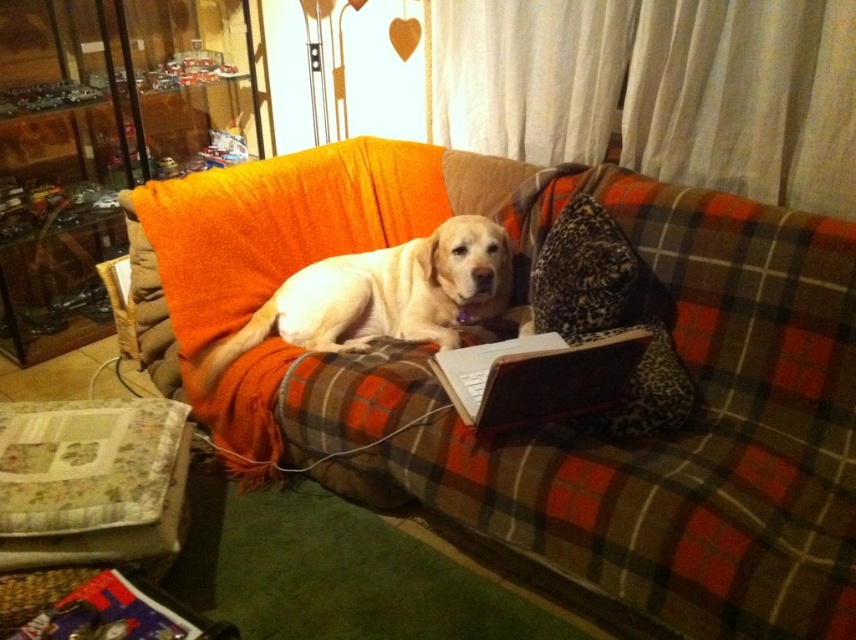
Does light yellow fur at center lie behind leopard print pillow at center?

Yes, it is behind leopard print pillow at center.

Can you confirm if light yellow fur at center is smaller than leopard print pillow at center?

No.

Who is more forward, [342,332] or [675,364]?

Point [675,364] is more forward.

You are a GUI agent. You are given a task and a screenshot of the screen. Output one action in this format:
    pyautogui.click(x=<x>, y=<y>)
    Task: Click on the light yellow fur at center
    
    Given the screenshot: What is the action you would take?
    pyautogui.click(x=385, y=296)

Can you confirm if leopard print pillow at center is wider than metallic silver book at lower left?

No.

Is leopard print pillow at center below metallic silver book at lower left?

No, leopard print pillow at center is not below metallic silver book at lower left.

Is point (669, 387) positioned behind point (177, 605)?

Yes, it is behind point (177, 605).

Locate an element on the screen. leopard print pillow at center is located at coordinates (610, 316).

Is light yellow fur at center to the right of silver metallic laptop at center from the viewer's perspective?

No, light yellow fur at center is not to the right of silver metallic laptop at center.

Identify the location of light yellow fur at center. (385, 296).